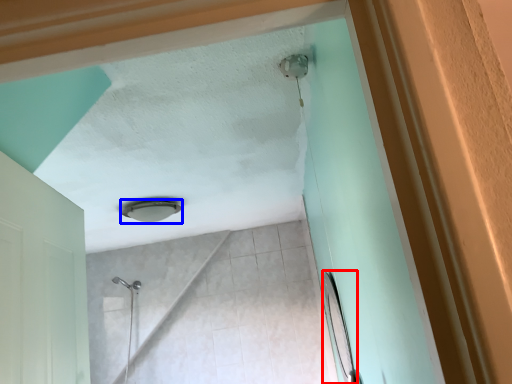
Question: Which point is closer to the camera, mirror (highlighted by a red box) or lamp (highlighted by a blue box)?

Choices:
 (A) mirror
 (B) lamp

Answer: (A)